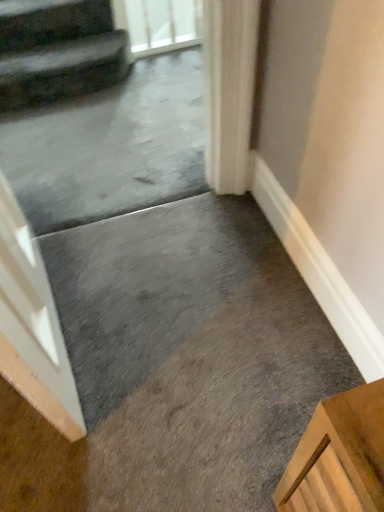
Question: Does clear glass screen door at upper center appear on the left side of dark gray plush stairs at upper left?

Choices:
 (A) no
 (B) yes

Answer: (A)

Question: Is clear glass screen door at upper center taller than dark gray plush stairs at upper left?

Choices:
 (A) no
 (B) yes

Answer: (B)

Question: Does clear glass screen door at upper center lie behind dark gray plush stairs at upper left?

Choices:
 (A) no
 (B) yes

Answer: (B)

Question: Does clear glass screen door at upper center come in front of dark gray plush stairs at upper left?

Choices:
 (A) no
 (B) yes

Answer: (A)

Question: Can you confirm if clear glass screen door at upper center is shorter than dark gray plush stairs at upper left?

Choices:
 (A) yes
 (B) no

Answer: (B)

Question: Does clear glass screen door at upper center have a lesser width compared to dark gray plush stairs at upper left?

Choices:
 (A) yes
 (B) no

Answer: (A)

Question: Does dark gray plush stairs at upper left have a greater width compared to clear glass screen door at upper center?

Choices:
 (A) yes
 (B) no

Answer: (A)

Question: Would you consider dark gray plush stairs at upper left to be distant from clear glass screen door at upper center?

Choices:
 (A) no
 (B) yes

Answer: (A)

Question: From the image's perspective, is dark gray plush stairs at upper left located beneath clear glass screen door at upper center?

Choices:
 (A) yes
 (B) no

Answer: (A)

Question: Does dark gray plush stairs at upper left have a lesser height compared to clear glass screen door at upper center?

Choices:
 (A) no
 (B) yes

Answer: (B)

Question: Is the depth of dark gray plush stairs at upper left greater than that of clear glass screen door at upper center?

Choices:
 (A) yes
 (B) no

Answer: (B)

Question: Is clear glass screen door at upper center located within dark gray plush stairs at upper left?

Choices:
 (A) yes
 (B) no

Answer: (B)

Question: Is dark gray plush stairs at upper left inside or outside of clear glass screen door at upper center?

Choices:
 (A) outside
 (B) inside

Answer: (A)